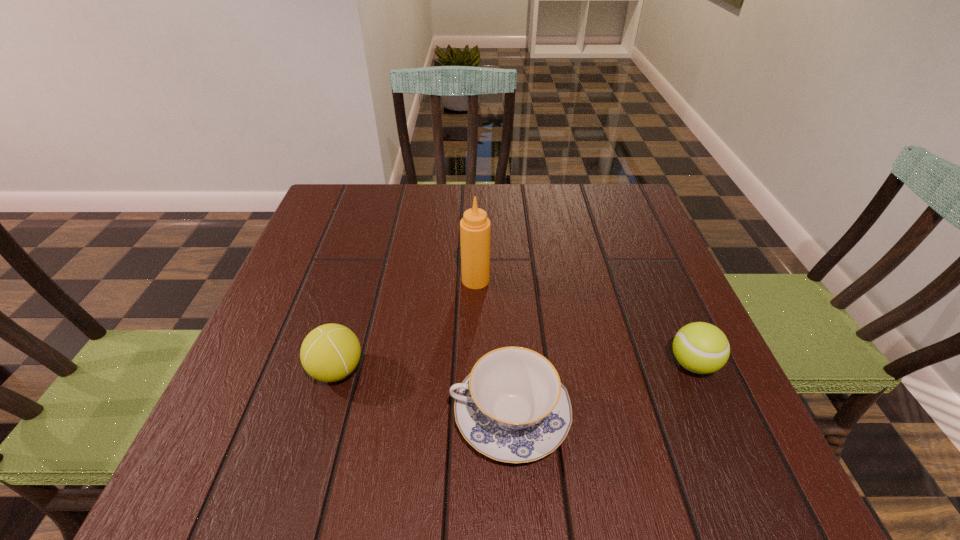
Identify the location of free space located 0.240m on the left of the rightmost object. Image resolution: width=960 pixels, height=540 pixels. (540, 364).

At what (x,y) coordinates should I click in order to perform the action: click on object that is at the near edge. Please return your answer as a coordinate pair (x, y). The image size is (960, 540). Looking at the image, I should click on (512, 407).

Locate an element on the screen. This screenshot has height=540, width=960. object located at the left edge is located at coordinates (330, 352).

Where is `object present at the right edge`? The height and width of the screenshot is (540, 960). object present at the right edge is located at coordinates (702, 348).

Identify the location of free space at the far edge. Image resolution: width=960 pixels, height=540 pixels. click(x=382, y=228).

In the image, there is a desktop. Identify the location of blank space at the near edge. (573, 454).

Locate an element on the screen. The height and width of the screenshot is (540, 960). vacant area at the left edge is located at coordinates (352, 278).

This screenshot has width=960, height=540. I want to click on vacant space at the right edge of the desktop, so click(x=666, y=325).

This screenshot has width=960, height=540. I want to click on vacant space at the far left corner of the desktop, so click(x=363, y=198).

You are a GUI agent. You are given a task and a screenshot of the screen. Output one action in this format:
    pyautogui.click(x=<x>, y=<y>)
    Task: Click on the free space between the leftmost object and the condiment
    The image size is (960, 540).
    Given the screenshot: What is the action you would take?
    pyautogui.click(x=406, y=325)